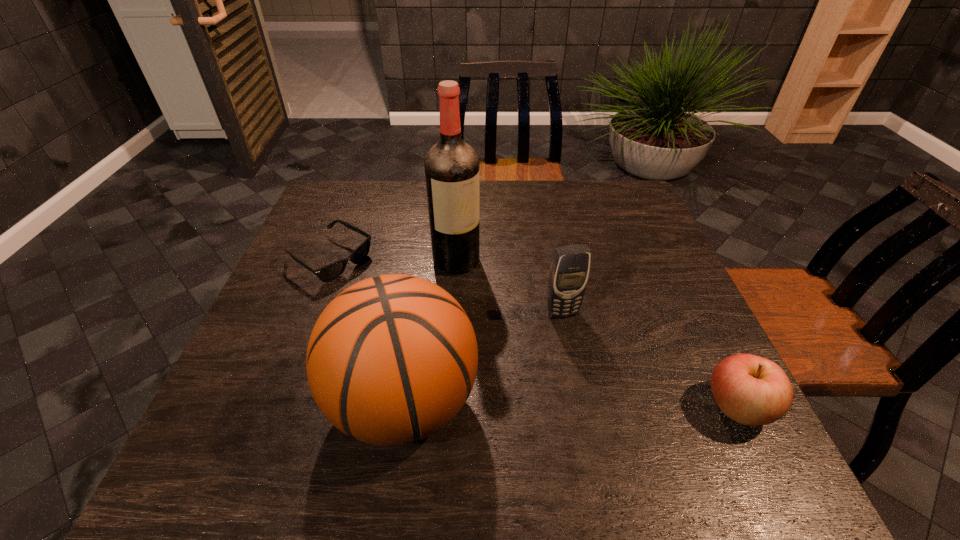
This screenshot has width=960, height=540. Find the location of `vacant space situated on the front-facing side of the sunglasses`. vacant space situated on the front-facing side of the sunglasses is located at coordinates (447, 331).

Locate an element on the screen. The width and height of the screenshot is (960, 540). free region located 0.340m on the front-facing side of the sunglasses is located at coordinates (461, 340).

Find the location of a particular element. vacant space located 0.220m on the front face of the cellular telephone is located at coordinates (603, 402).

Find the location of a particular element. The image size is (960, 540). free space located on the front face of the cellular telephone is located at coordinates (605, 407).

I want to click on free spot located on the front face of the cellular telephone, so click(x=583, y=358).

This screenshot has height=540, width=960. Identify the location of free space located on the front-facing side of the tallest object. (479, 285).

You are a GUI agent. You are given a task and a screenshot of the screen. Output one action in this format:
    pyautogui.click(x=<x>, y=<y>)
    Task: Click on the vacant space situated on the front-facing side of the tallest object
    The image size is (960, 540).
    Given the screenshot: What is the action you would take?
    pyautogui.click(x=530, y=339)

Locate an element on the screen. vacant region located on the front-facing side of the tallest object is located at coordinates (565, 377).

This screenshot has width=960, height=540. Identify the location of basketball located at the near edge. (392, 359).

Find the location of a particular element. The width and height of the screenshot is (960, 540). apple that is positioned at the near edge is located at coordinates (751, 390).